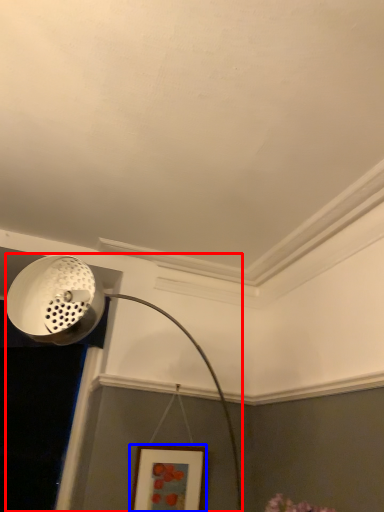
Question: Which of the following is the farthest to the observer, lamp (highlighted by a red box) or picture frame (highlighted by a blue box)?

Choices:
 (A) lamp
 (B) picture frame

Answer: (B)